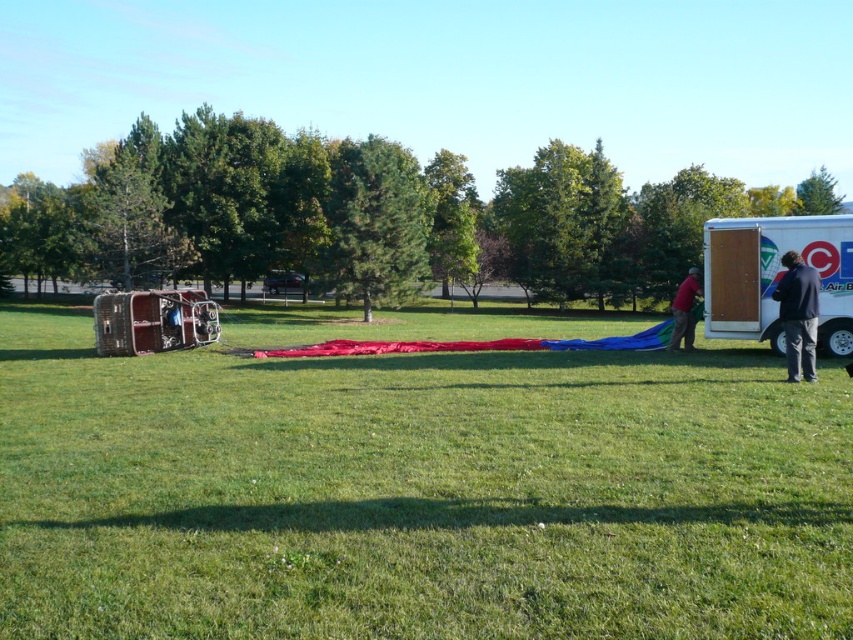
You are a delivery person who needs to load a dark blue jacket at right into a storage compartment on top of the white cardboard trailer at right. Can you lift the jacket high enough to place it there without any assistance?

The white cardboard trailer at right has a greater height compared to dark blue jacket at right, so the jacket may be too short to reach the storage compartment on top of the trailer. You might need assistance to lift it higher.

You are a photographer setting up a tripod on the green grassy field at center. You notice the dark blue jacket at right in your shot. Since you want to avoid the jacket in your composition, which direction should you move the tripod to ensure the jacket is no longer in frame?

The dark blue jacket at right is taller than the green grassy field at center. To avoid the jacket in your composition, move the tripod away from the dark blue jacket at right so that the shorter green grassy field at center blocks the view of the jacket.